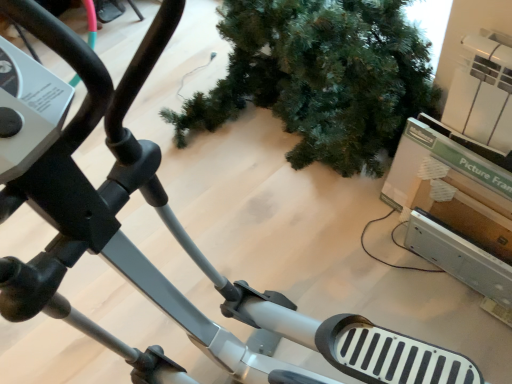
What is the approximate width of white plastic wii at lower right?

white plastic wii at lower right is 2.18 inches wide.

Find the location of a particular element. The width and height of the screenshot is (512, 384). white plastic wii at lower right is located at coordinates (459, 257).

This screenshot has height=384, width=512. What do you see at coordinates (459, 257) in the screenshot?
I see `white plastic wii at lower right` at bounding box center [459, 257].

Locate an element on the screen. The image size is (512, 384). white plastic wii at lower right is located at coordinates (459, 257).